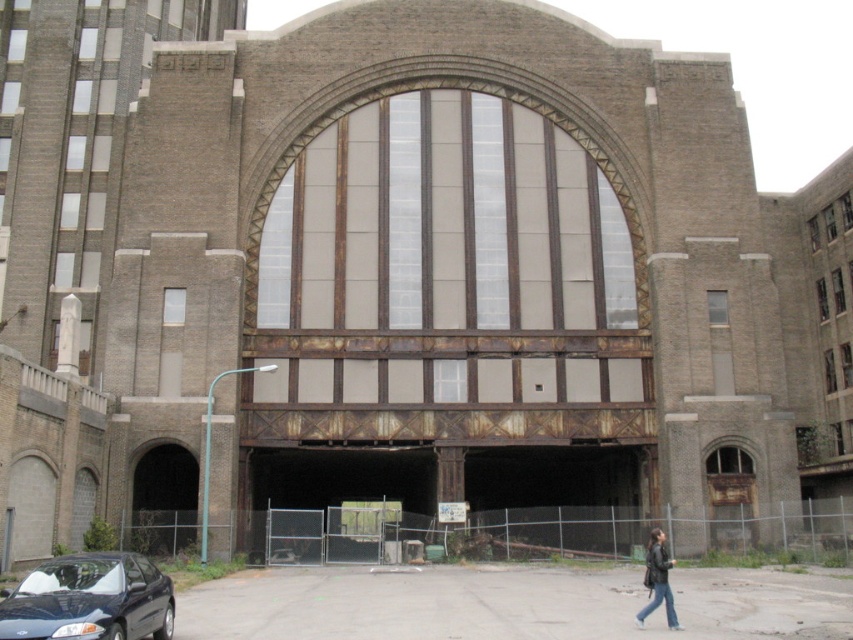
Between point (128, 612) and point (653, 556), which one is positioned behind?

Point (653, 556)

Is shiny black sedan at lower left bigger than black leather jacket at lower right?

Correct, shiny black sedan at lower left is larger in size than black leather jacket at lower right.

The image size is (853, 640). Describe the element at coordinates (90, 600) in the screenshot. I see `shiny black sedan at lower left` at that location.

This screenshot has height=640, width=853. I want to click on shiny black sedan at lower left, so click(x=90, y=600).